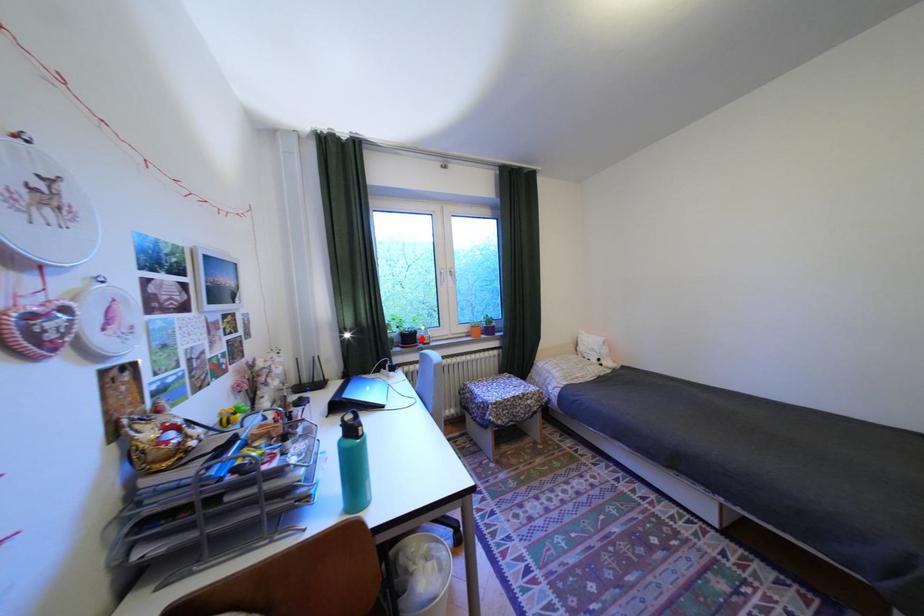
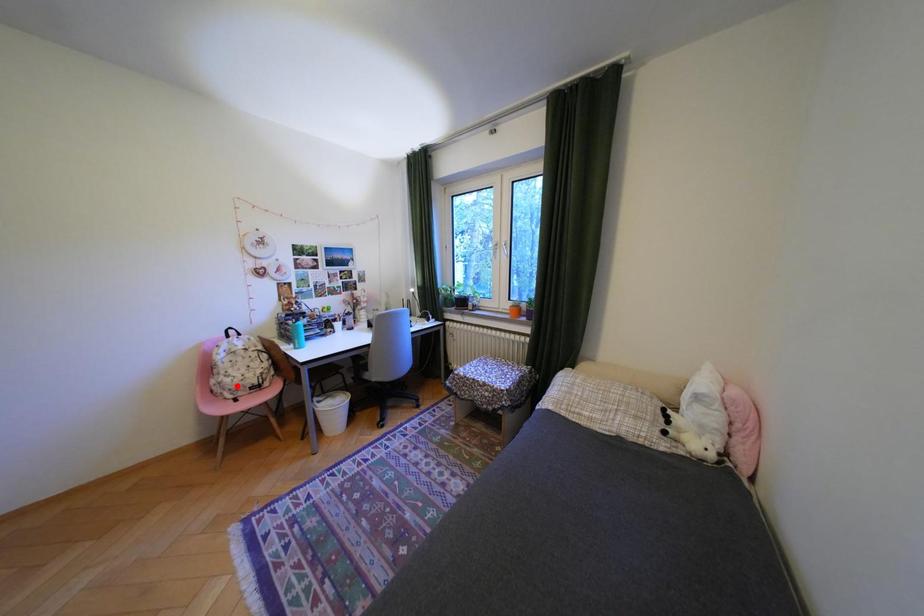
I am providing you with two images of the same scene from different viewpoints. A red point is marked on the first image and another point is marked on the second image. Do the highlighted points in image1 and image2 indicate the same real-world spot?

No